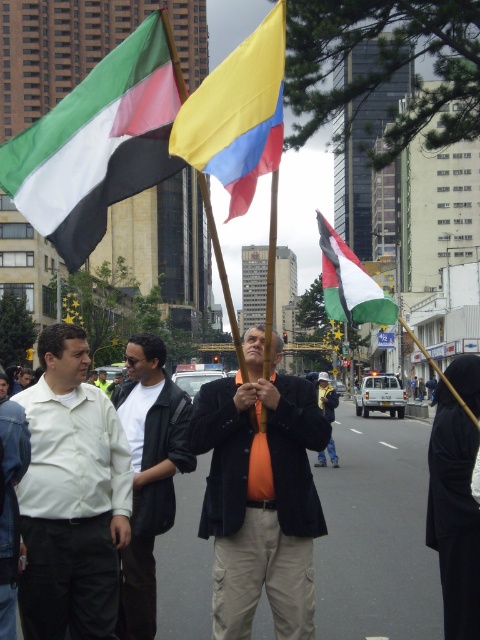
Question: Which of the following is the farthest from the observer?

Choices:
 (A) white shirt at center
 (B) yellow fabric flag at center
 (C) green-white-red striped flag at center

Answer: (A)

Question: Based on their relative distances, which object is nearer to the green-white-red striped flag at center?

Choices:
 (A) yellow fabric flag at center
 (B) white matte shirt at left
 (C) matte fabric flag at upper left
 (D) orange fabric at center

Answer: (D)

Question: Can you confirm if orange fabric shirt at center is positioned above white matte shirt at left?

Choices:
 (A) yes
 (B) no

Answer: (B)

Question: Does matte fabric flag at upper left appear over orange fabric at center?

Choices:
 (A) yes
 (B) no

Answer: (A)

Question: Which of the following is the farthest from the observer?

Choices:
 (A) (230, 93)
 (B) (146, 410)
 (C) (43, 348)
 (D) (248, 572)

Answer: (B)

Question: Does matte fabric flag at upper left appear over orange fabric at center?

Choices:
 (A) yes
 (B) no

Answer: (A)